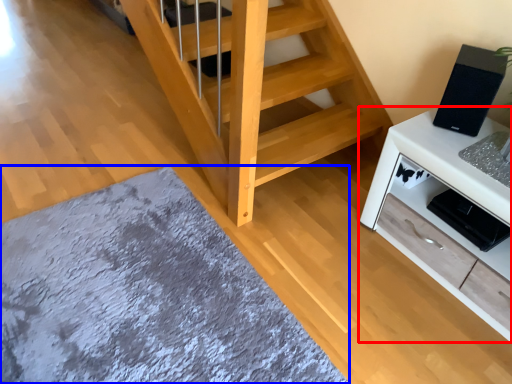
Question: Among these objects, which one is nearest to the camera, cabinetry (highlighted by a red box) or mat (highlighted by a blue box)?

Choices:
 (A) cabinetry
 (B) mat

Answer: (B)